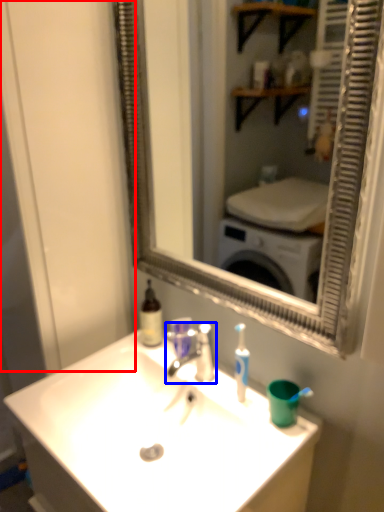
Question: Which point is further to the camera, glass door (highlighted by a red box) or tap (highlighted by a blue box)?

Choices:
 (A) glass door
 (B) tap

Answer: (B)